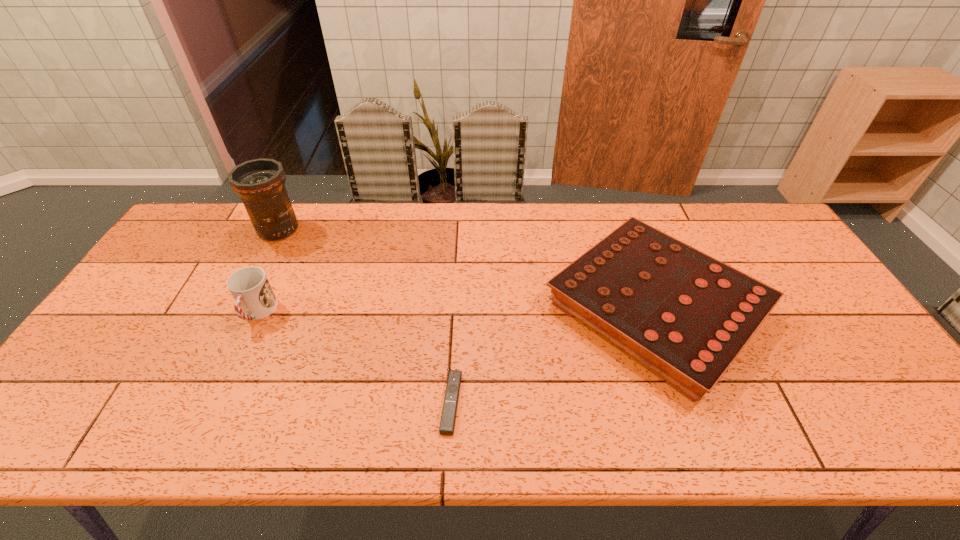
Identify the location of the tallest object. (260, 183).

The width and height of the screenshot is (960, 540). I want to click on the third shortest object, so click(x=254, y=298).

Identify the location of gameboard. The height and width of the screenshot is (540, 960). (x=687, y=316).

This screenshot has height=540, width=960. Find the location of `the rightmost object`. the rightmost object is located at coordinates pos(687,316).

The height and width of the screenshot is (540, 960). What are the coordinates of `the third object from left to right` in the screenshot? It's located at (448, 417).

Image resolution: width=960 pixels, height=540 pixels. What are the coordinates of `the shortest object` in the screenshot? It's located at (448, 417).

The image size is (960, 540). Identify the location of free spot located on the front of the telephoto lens. (261, 264).

What are the coordinates of `vacant space located 0.240m on the side of the third shortest object where the handle is located` in the screenshot? It's located at (209, 416).

Locate an element on the screen. The height and width of the screenshot is (540, 960). blank area located 0.060m on the back of the rightmost object is located at coordinates (625, 226).

In order to click on vacant region located on the right of the second object from right to left in this screenshot , I will do `click(634, 402)`.